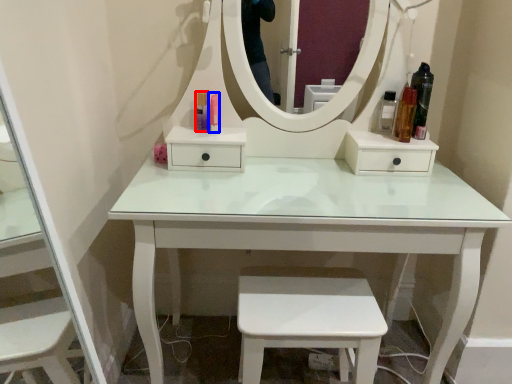
Question: Which object appears closest to the camera in this image, toiletry (highlighted by a red box) or toiletry (highlighted by a blue box)?

Choices:
 (A) toiletry
 (B) toiletry

Answer: (B)